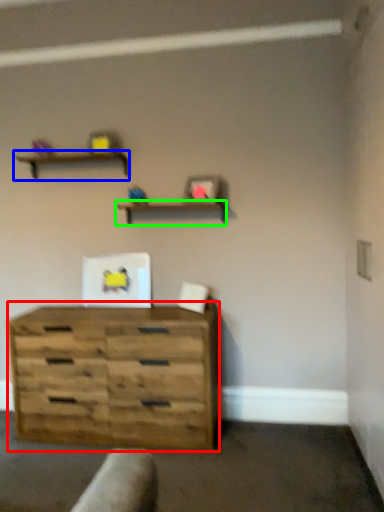
Question: Estimate the real-world distances between objects in this image. Which object is closer to chest of drawers (highlighted by a red box), shelf (highlighted by a blue box) or shelf (highlighted by a green box)?

Choices:
 (A) shelf
 (B) shelf

Answer: (B)